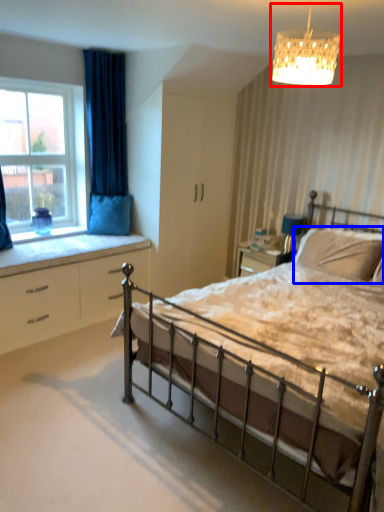
Question: Which of the following is the closest to the observer, lamp (highlighted by a red box) or pillow (highlighted by a blue box)?

Choices:
 (A) lamp
 (B) pillow

Answer: (A)